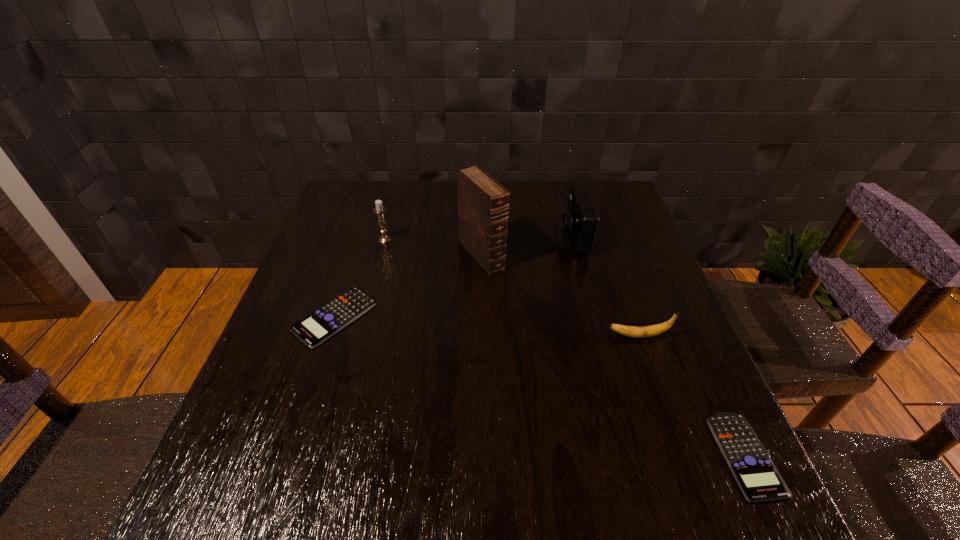
Please point a spot to place another calculator for symmetrical spacing. Please provide its 2D coordinates. Your answer should be formatted as a tuple, i.e. [(x, y)], where the tuple contains the x and y coordinates of a point satisfying the conditions above.

[(512, 377)]